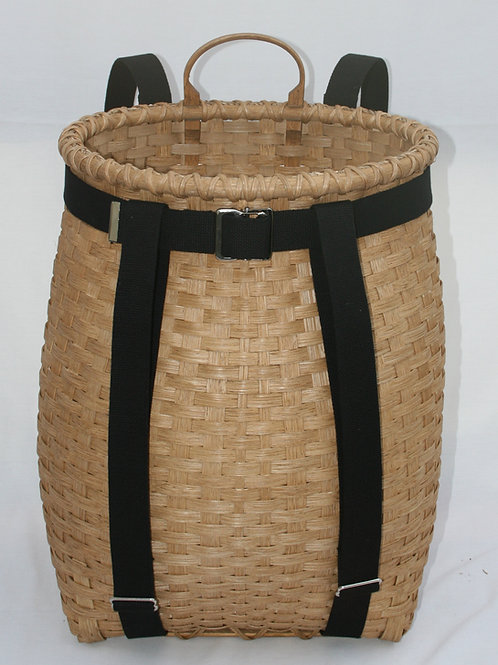
Locate an element on the screen. The width and height of the screenshot is (498, 665). woven basket is located at coordinates 261,452.